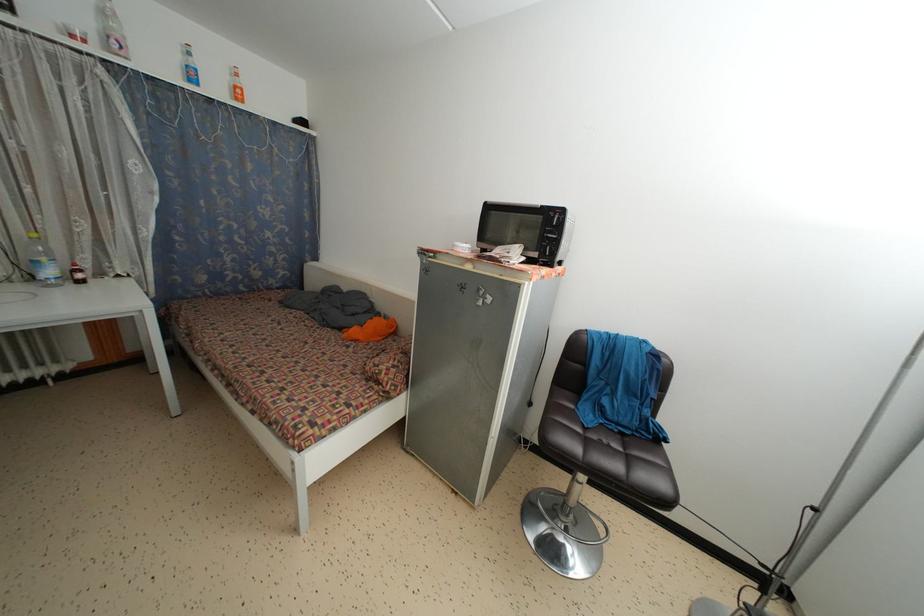
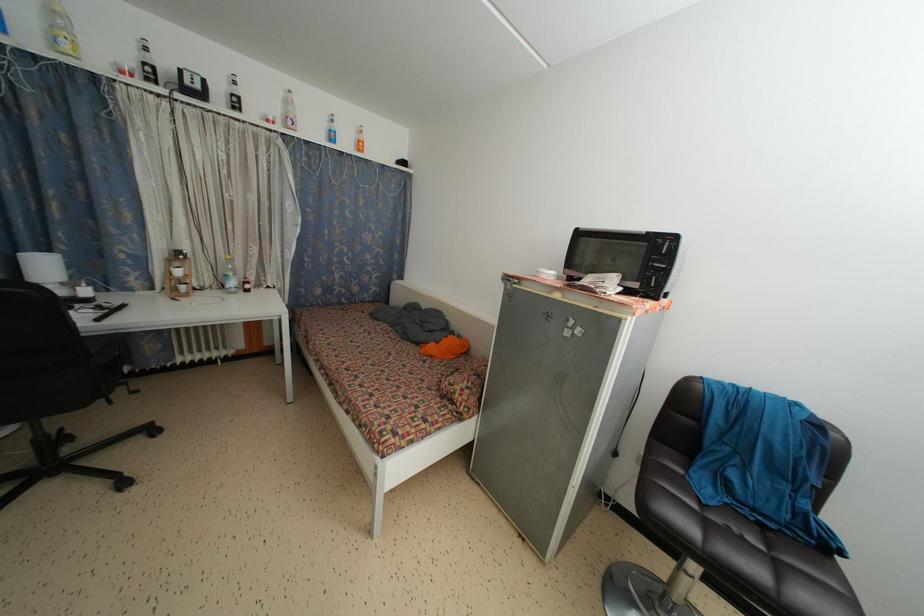
The point at [561,249] is marked in the first image. Where is the corresponding point in the second image?

(669, 280)